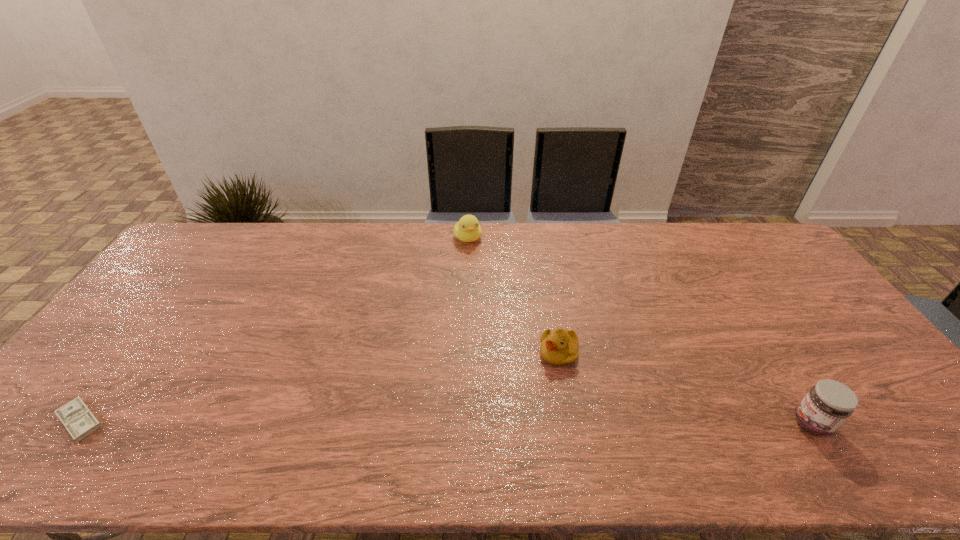
Where is `vacant area that lies between the second object from right to left and the farthest object`? The image size is (960, 540). vacant area that lies between the second object from right to left and the farthest object is located at coordinates (514, 295).

Find the location of a particular element. Image resolution: width=960 pixels, height=540 pixels. empty location between the money and the third nearest object is located at coordinates click(x=320, y=387).

Where is `empty space between the farthest object and the third object from left to right`? empty space between the farthest object and the third object from left to right is located at coordinates (514, 295).

Locate an element on the screen. The image size is (960, 540). vacant point located between the left duckling and the money is located at coordinates (275, 329).

Where is `vacant point located between the left duckling and the third nearest object`? This screenshot has width=960, height=540. vacant point located between the left duckling and the third nearest object is located at coordinates (514, 295).

Identify the location of blank region between the second farthest object and the shortest object. The height and width of the screenshot is (540, 960). (320, 387).

You are a GUI agent. You are given a task and a screenshot of the screen. Output one action in this format:
    pyautogui.click(x=<x>, y=<y>)
    Task: Click on the unoccupied position between the third object from left to right and the jam
    Image resolution: width=960 pixels, height=540 pixels.
    Given the screenshot: What is the action you would take?
    pyautogui.click(x=685, y=388)

Where is `object that ranks as the third closest to the left duckling`? object that ranks as the third closest to the left duckling is located at coordinates (80, 422).

You are a GUI agent. You are given a task and a screenshot of the screen. Output one action in this format:
    pyautogui.click(x=<x>, y=<y>)
    Task: Click on the object that is the second closest to the farther duckling
    This screenshot has height=540, width=960.
    Given the screenshot: What is the action you would take?
    pyautogui.click(x=829, y=403)

Where is `free region that satisfies the following two spatial constraints: 1. on the front side of the second object from right to left; 2. on the front label of the rightmost object`? The image size is (960, 540). free region that satisfies the following two spatial constraints: 1. on the front side of the second object from right to left; 2. on the front label of the rightmost object is located at coordinates (571, 423).